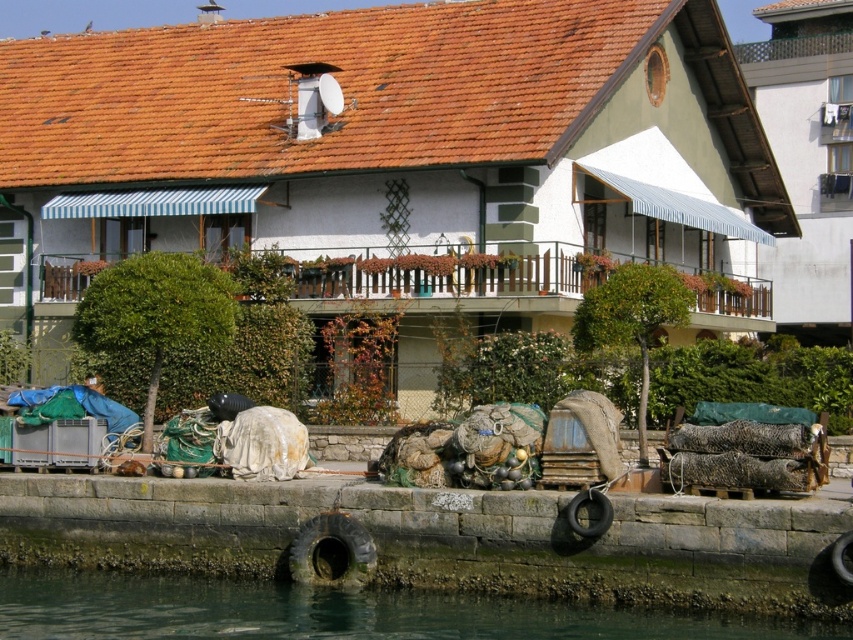
You are standing on the stone wall in front of the building and want to step onto the dark gray stone dock at lower center and the clear water at lower left. Which surface can you step onto without needing to move further away from your current position?

The dark gray stone dock at lower center is closer to the viewer than the clear water at lower left, so you can step onto the dark gray stone dock at lower center without needing to move further away from your current position.

You are a photographer planning to take a picture of the waterfront scene. You want to ensure that both the dark gray stone dock at lower center and the clear water at lower left are clearly visible in your shot. Given their sizes, which object should you focus on to capture both effectively?

Since the dark gray stone dock at lower center is bigger than the clear water at lower left, you should focus on the dark gray stone dock at lower center to ensure both are visible in the frame.